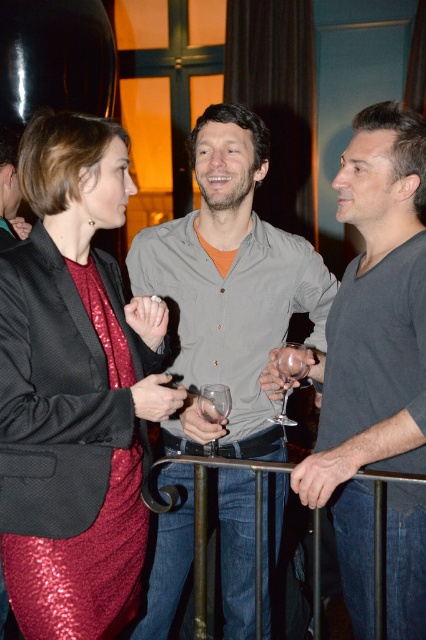
Who is more forward, (259,493) or (299,374)?

Positioned in front is point (259,493).

Is black metal railing at lower center closer to the viewer compared to transparent glass wine glass at center?

Yes, it is.

From the picture: Measure the distance between point [313,605] and camera.

A distance of 1.59 meters exists between point [313,605] and camera.

Identify the location of black metal railing at lower center. (206, 525).

Locate an element on the screen. The height and width of the screenshot is (640, 426). gray matte shirt at center is located at coordinates (373, 342).

Is gray matte shirt at center above transparent glass at center?

Correct, gray matte shirt at center is located above transparent glass at center.

Does point (348, 474) lie behind point (215, 397)?

No, (348, 474) is closer to viewer.

Where is `gray matte shirt at center`? The image size is (426, 640). gray matte shirt at center is located at coordinates (373, 342).

Consider the image. Does gray cotton shirt at center appear on the right side of transparent glass at center?

Correct, you'll find gray cotton shirt at center to the right of transparent glass at center.

Can you confirm if gray cotton shirt at center is positioned below transparent glass at center?

Incorrect, gray cotton shirt at center is not positioned below transparent glass at center.

The height and width of the screenshot is (640, 426). I want to click on gray cotton shirt at center, so click(x=230, y=285).

At what (x,y) coordinates should I click in order to perform the action: click on gray cotton shirt at center. Please return your answer as a coordinate pair (x, y). Looking at the image, I should click on (230, 285).